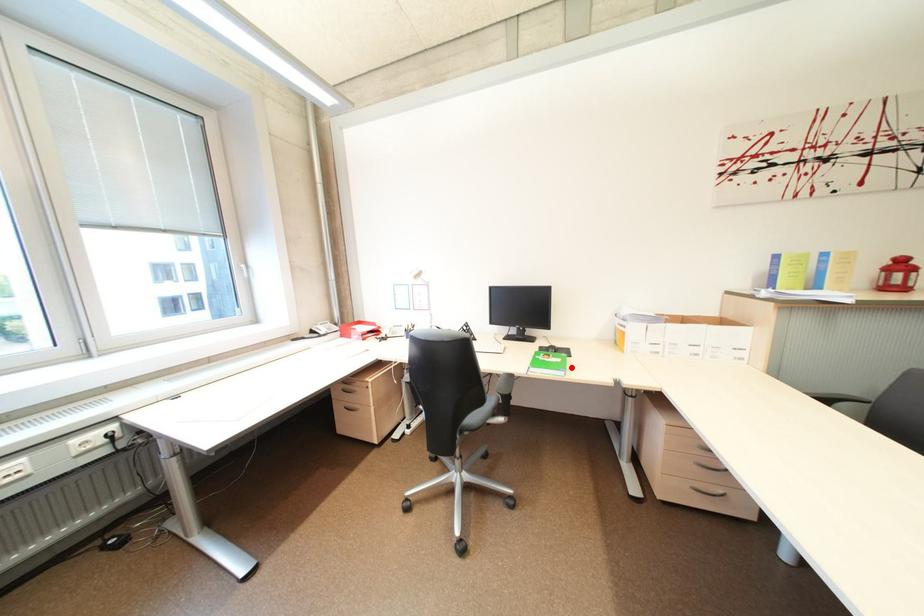
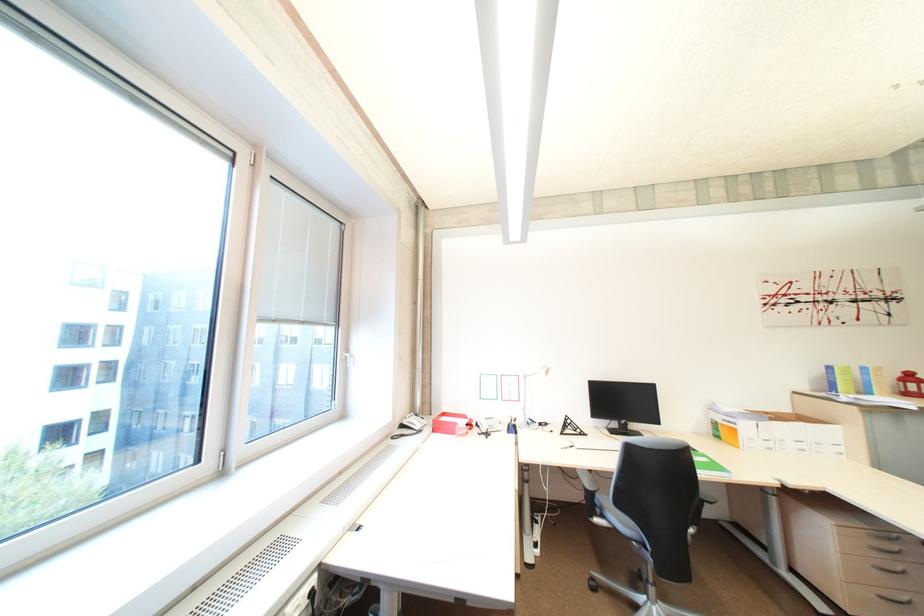
Where in the second image is the point corresponding to the highlighted location from the first image?

(725, 468)